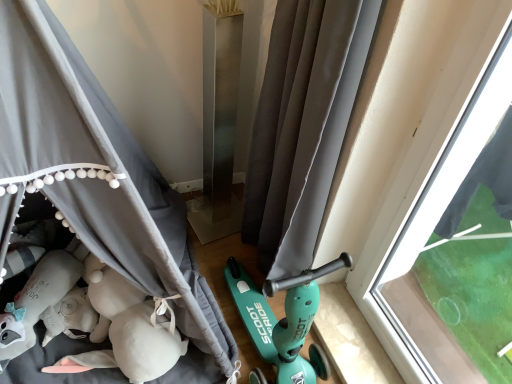
Identify the location of transparent glass window at right. Image resolution: width=512 pixels, height=384 pixels. (433, 205).

Locate an element on the screen. This screenshot has width=512, height=384. transparent glass window at right is located at coordinates (433, 205).

Which object is wider, gray fabric curtain at center, arranged as the 2th curtain when viewed from the left, or gray fabric curtain at center, arranged as the 1th curtain when viewed from the left?

With larger width is gray fabric curtain at center, arranged as the 1th curtain when viewed from the left.

Is gray fabric curtain at center, arranged as the 2th curtain when viewed from the left, oriented away from gray fabric curtain at center, which ranks as the second curtain in right-to-left order?

Yes, gray fabric curtain at center, which ranks as the second curtain in right-to-left order, is at the back of gray fabric curtain at center, arranged as the 2th curtain when viewed from the left.

Considering the sizes of objects gray fabric curtain at center, arranged as the 2th curtain when viewed from the left, and gray fabric curtain at center, which ranks as the second curtain in right-to-left order, in the image provided, who is shorter, gray fabric curtain at center, arranged as the 2th curtain when viewed from the left, or gray fabric curtain at center, which ranks as the second curtain in right-to-left order,?

gray fabric curtain at center, arranged as the 2th curtain when viewed from the left, is shorter.

Considering the relative sizes of transparent glass window at right and gray fabric curtain at center, arranged as the 2th curtain when viewed from the left, in the image provided, is transparent glass window at right smaller than gray fabric curtain at center, arranged as the 2th curtain when viewed from the left,?

Yes, transparent glass window at right is smaller than gray fabric curtain at center, arranged as the 2th curtain when viewed from the left.

From a real-world perspective, is transparent glass window at right located beneath gray fabric curtain at center, the 1th curtain in the right-to-left sequence?

Incorrect, from a real-world perspective, transparent glass window at right is higher than gray fabric curtain at center, the 1th curtain in the right-to-left sequence.

Are transparent glass window at right and gray fabric curtain at center, arranged as the 2th curtain when viewed from the left, far apart?

No, transparent glass window at right is not far from gray fabric curtain at center, arranged as the 2th curtain when viewed from the left.

Who is more distant, transparent glass window at right or gray fabric curtain at center, the 1th curtain in the right-to-left sequence?

gray fabric curtain at center, the 1th curtain in the right-to-left sequence, is more distant.

Is gray fabric curtain at center, arranged as the 1th curtain when viewed from the left, far from gray fabric curtain at center, arranged as the 2th curtain when viewed from the left?

gray fabric curtain at center, arranged as the 1th curtain when viewed from the left, is near gray fabric curtain at center, arranged as the 2th curtain when viewed from the left, not far away.

Is gray fabric curtain at center, which ranks as the second curtain in right-to-left order, at the left side of gray fabric curtain at center, the 1th curtain in the right-to-left sequence?

Yes.

How different are the orientations of gray fabric curtain at center, arranged as the 1th curtain when viewed from the left, and gray fabric curtain at center, the 1th curtain in the right-to-left sequence, in degrees?

The angular difference between gray fabric curtain at center, arranged as the 1th curtain when viewed from the left, and gray fabric curtain at center, the 1th curtain in the right-to-left sequence, is 87.9 degrees.

Looking at this image, is gray fabric curtain at center, arranged as the 1th curtain when viewed from the left, smaller than gray fabric curtain at center, arranged as the 2th curtain when viewed from the left?

Incorrect, gray fabric curtain at center, arranged as the 1th curtain when viewed from the left, is not smaller in size than gray fabric curtain at center, arranged as the 2th curtain when viewed from the left.

Is point (289, 29) closer to viewer compared to point (406, 190)?

Yes.

Is transparent glass window at right inside gray fabric curtain at center, the 1th curtain in the right-to-left sequence?

Definitely not — transparent glass window at right is not inside gray fabric curtain at center, the 1th curtain in the right-to-left sequence.

From the picture: From a real-world perspective, which object stands above the other?

transparent glass window at right is physically above.

I want to click on window above the gray fabric curtain at center, the 1th curtain in the right-to-left sequence (from a real-world perspective), so pos(433,205).

This screenshot has width=512, height=384. What are the coordinates of `window located behind the gray fabric curtain at center, arranged as the 1th curtain when viewed from the left` in the screenshot? It's located at (433, 205).

Is gray fabric curtain at center, which ranks as the second curtain in right-to-left order, next to transparent glass window at right and touching it?

gray fabric curtain at center, which ranks as the second curtain in right-to-left order, is not next to transparent glass window at right, and they're not touching.

Consider the image. From a real-world perspective, who is located lower, gray fabric curtain at center, which ranks as the second curtain in right-to-left order, or transparent glass window at right?

transparent glass window at right is physically lower.

Considering their positions, is gray fabric curtain at center, arranged as the 1th curtain when viewed from the left, located in front of or behind transparent glass window at right?

In the image, gray fabric curtain at center, arranged as the 1th curtain when viewed from the left, appears in front of transparent glass window at right.

Which object is wider, transparent glass window at right or gray fabric curtain at center, which ranks as the second curtain in right-to-left order?

gray fabric curtain at center, which ranks as the second curtain in right-to-left order.

At what (x,y) coordinates should I click in order to perform the action: click on window behind the gray fabric curtain at center, which ranks as the second curtain in right-to-left order. Please return your answer as a coordinate pair (x, y). The image size is (512, 384). Looking at the image, I should click on tap(433, 205).

Is transparent glass window at right surrounding gray fabric curtain at center, arranged as the 1th curtain when viewed from the left?

No, gray fabric curtain at center, arranged as the 1th curtain when viewed from the left, is not inside transparent glass window at right.

The image size is (512, 384). I want to click on curtain above the gray fabric curtain at center, arranged as the 1th curtain when viewed from the left (from the image's perspective), so click(x=302, y=125).

In order to click on window in front of the gray fabric curtain at center, the 1th curtain in the right-to-left sequence in this screenshot , I will do `click(433, 205)`.

From the image, which object appears to be nearer to gray fabric curtain at center, the 1th curtain in the right-to-left sequence, transparent glass window at right or gray fabric curtain at center, which ranks as the second curtain in right-to-left order?

transparent glass window at right lies closer to gray fabric curtain at center, the 1th curtain in the right-to-left sequence, than the other object.

Estimate the real-world distances between objects in this image. Which object is further from gray fabric curtain at center, arranged as the 2th curtain when viewed from the left, gray fabric curtain at center, which ranks as the second curtain in right-to-left order, or transparent glass window at right?

Among the two, gray fabric curtain at center, which ranks as the second curtain in right-to-left order, is located further to gray fabric curtain at center, arranged as the 2th curtain when viewed from the left.

Looking at this image, based on their spatial positions, is gray fabric curtain at center, arranged as the 2th curtain when viewed from the left, or transparent glass window at right further from gray fabric curtain at center, arranged as the 1th curtain when viewed from the left?

Based on the image, transparent glass window at right appears to be further to gray fabric curtain at center, arranged as the 1th curtain when viewed from the left.

Which object lies further to the anchor point transparent glass window at right, gray fabric curtain at center, arranged as the 1th curtain when viewed from the left, or gray fabric curtain at center, arranged as the 2th curtain when viewed from the left?

gray fabric curtain at center, arranged as the 1th curtain when viewed from the left, is positioned further to the anchor transparent glass window at right.

Estimate the real-world distances between objects in this image. Which object is closer to gray fabric curtain at center, which ranks as the second curtain in right-to-left order, transparent glass window at right or gray fabric curtain at center, arranged as the 2th curtain when viewed from the left?

gray fabric curtain at center, arranged as the 2th curtain when viewed from the left, is closer to gray fabric curtain at center, which ranks as the second curtain in right-to-left order.

Estimate the real-world distances between objects in this image. Which object is closer to transparent glass window at right, gray fabric curtain at center, the 1th curtain in the right-to-left sequence, or gray fabric curtain at center, which ranks as the second curtain in right-to-left order?

The object closer to transparent glass window at right is gray fabric curtain at center, the 1th curtain in the right-to-left sequence.

Where is `curtain between gray fabric curtain at center, arranged as the 1th curtain when viewed from the left, and transparent glass window at right from left to right`? The width and height of the screenshot is (512, 384). curtain between gray fabric curtain at center, arranged as the 1th curtain when viewed from the left, and transparent glass window at right from left to right is located at coordinates (302, 125).